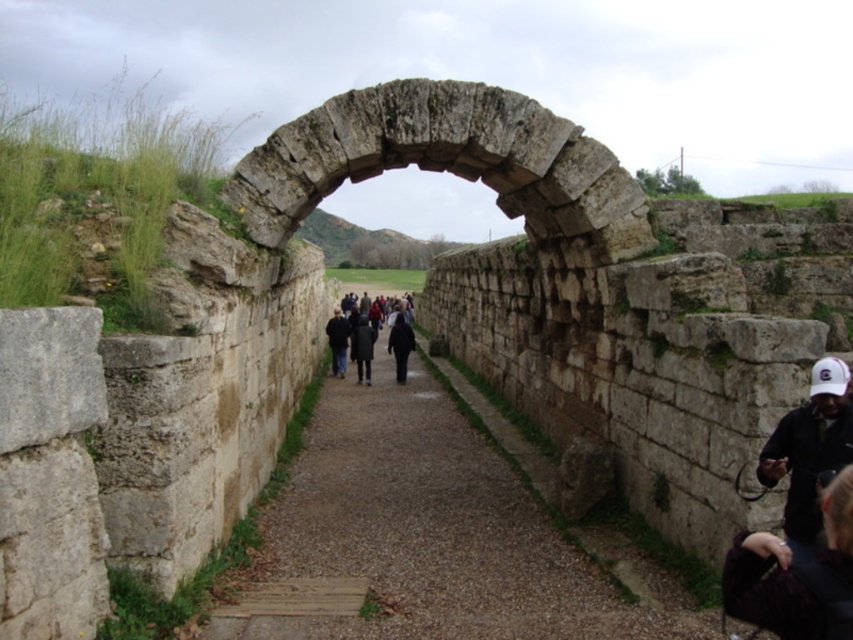
The height and width of the screenshot is (640, 853). Describe the element at coordinates (809, 451) in the screenshot. I see `black fabric cap at right` at that location.

Measure the distance between black fabric cap at right and camera.

black fabric cap at right and camera are 34.10 meters apart.

I want to click on black fabric cap at right, so click(809, 451).

Locate an element on the screen. The height and width of the screenshot is (640, 853). black fabric cap at right is located at coordinates (809, 451).

Where is `brown stone path at center`? Image resolution: width=853 pixels, height=640 pixels. brown stone path at center is located at coordinates (436, 536).

Consider the image. Can you confirm if brown stone path at center is smaller than black matte jacket at center?

Correct, brown stone path at center occupies less space than black matte jacket at center.

Locate an element on the screen. brown stone path at center is located at coordinates (436, 536).

You are a GUI agent. You are given a task and a screenshot of the screen. Output one action in this format:
    pyautogui.click(x=<x>, y=<y>)
    Task: Click on the brown stone path at center
    The height and width of the screenshot is (640, 853).
    Given the screenshot: What is the action you would take?
    pyautogui.click(x=436, y=536)

Who is higher up, brown stone path at center or dark gray coat at center?

dark gray coat at center is above.

Can you confirm if brown stone path at center is positioned to the left of dark gray coat at center?

In fact, brown stone path at center is to the right of dark gray coat at center.

Does point (328, 454) come behind point (358, 342)?

No.

You are a GUI agent. You are given a task and a screenshot of the screen. Output one action in this format:
    pyautogui.click(x=<x>, y=<y>)
    Task: Click on the brown stone path at center
    The width and height of the screenshot is (853, 640).
    Given the screenshot: What is the action you would take?
    pyautogui.click(x=436, y=536)